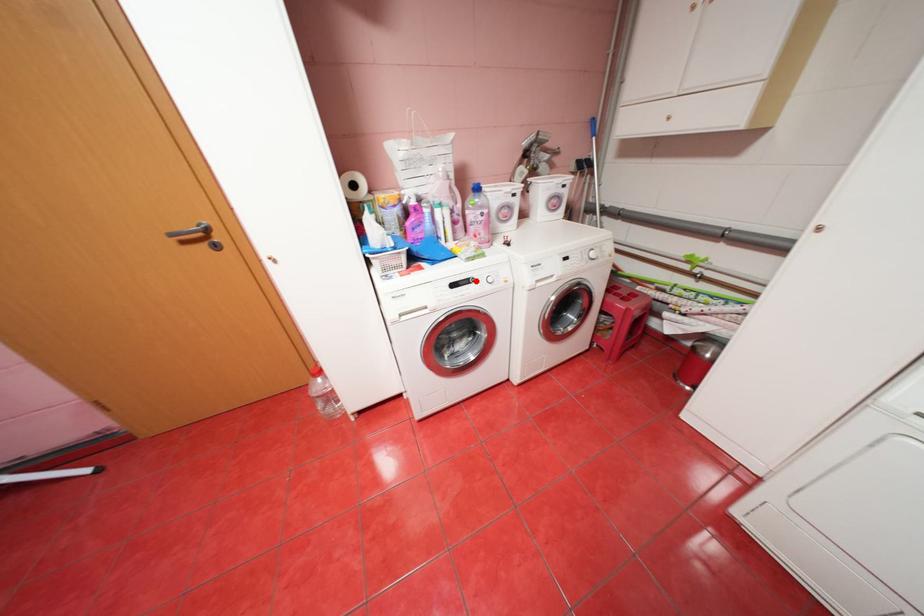
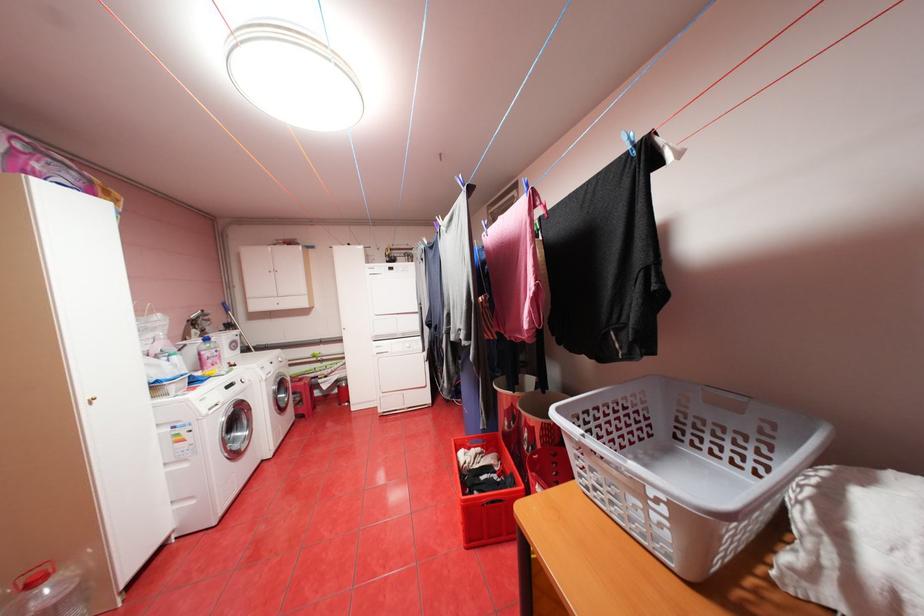
In the second image, find the point that corresponds to the highlighted location in the first image.

(241, 384)